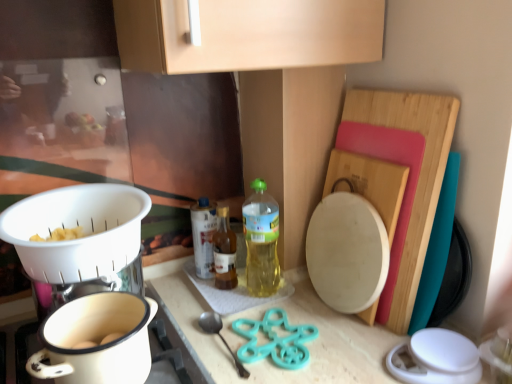
Question: Is wooden cutting board at right behind translucent plastic bottle at center, marked as the 3th bottle in a right-to-left arrangement?

Choices:
 (A) yes
 (B) no

Answer: (B)

Question: Is wooden cutting board at right to the right of translucent plastic bottle at center, marked as the 3th bottle in a right-to-left arrangement, from the viewer's perspective?

Choices:
 (A) yes
 (B) no

Answer: (A)

Question: From a real-world perspective, is wooden cutting board at right on translucent plastic bottle at center, positioned as the 1th bottle in left-to-right order?

Choices:
 (A) no
 (B) yes

Answer: (B)

Question: Can you confirm if wooden cutting board at right is shorter than translucent plastic bottle at center, marked as the 3th bottle in a right-to-left arrangement?

Choices:
 (A) no
 (B) yes

Answer: (A)

Question: Are wooden cutting board at right and translucent plastic bottle at center, marked as the 3th bottle in a right-to-left arrangement, far apart?

Choices:
 (A) yes
 (B) no

Answer: (B)

Question: Could you tell me if wooden cutting board at right is facing translucent plastic bottle at center, marked as the 3th bottle in a right-to-left arrangement?

Choices:
 (A) yes
 (B) no

Answer: (B)

Question: Does teal plastic spoon at lower center appear on the right side of white ceramic pot at lower left?

Choices:
 (A) no
 (B) yes

Answer: (B)

Question: Is teal plastic spoon at lower center turned away from white ceramic pot at lower left?

Choices:
 (A) yes
 (B) no

Answer: (B)

Question: Can we say teal plastic spoon at lower center lies outside white ceramic pot at lower left?

Choices:
 (A) no
 (B) yes

Answer: (B)

Question: From the image's perspective, would you say teal plastic spoon at lower center is shown under white ceramic pot at lower left?

Choices:
 (A) no
 (B) yes

Answer: (B)

Question: From a real-world perspective, is teal plastic spoon at lower center under white ceramic pot at lower left?

Choices:
 (A) yes
 (B) no

Answer: (A)

Question: Is the surface of teal plastic spoon at lower center in direct contact with white ceramic pot at lower left?

Choices:
 (A) no
 (B) yes

Answer: (A)

Question: Can you confirm if teal plastic spoon at lower center is wider than translucent plastic bottle at center, which ranks as the 3th bottle in left-to-right order?

Choices:
 (A) yes
 (B) no

Answer: (A)